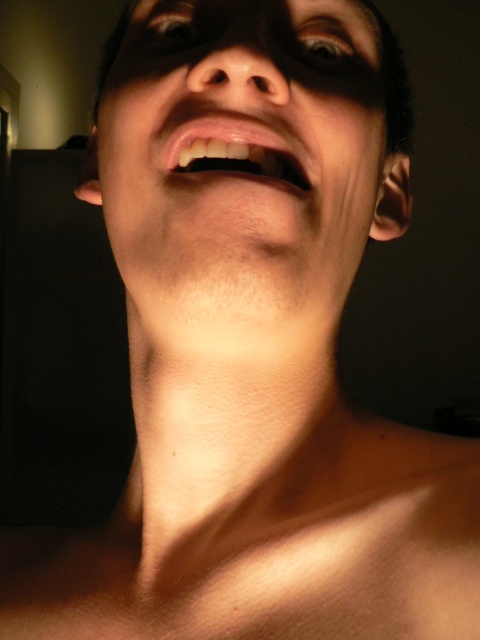
You are a dermatologist examining a patient. You notice a point at coordinates (240, 173) on their skin. Based on the image provided, what anatomical feature does this point most likely correspond to?

The point at coordinates (240, 173) corresponds to the smooth skin face at center, which is part of the patient.

Based on the scene description, can you determine if the smooth skin face at center is wider than the shiny blue eye at upper center?

Yes, the smooth skin face at center is wider than the shiny blue eye at upper center according to the description.